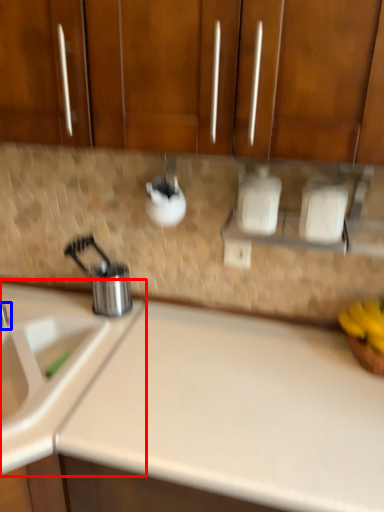
Question: Which point is closer to the camera, sink (highlighted by a red box) or tap (highlighted by a blue box)?

Choices:
 (A) sink
 (B) tap

Answer: (A)